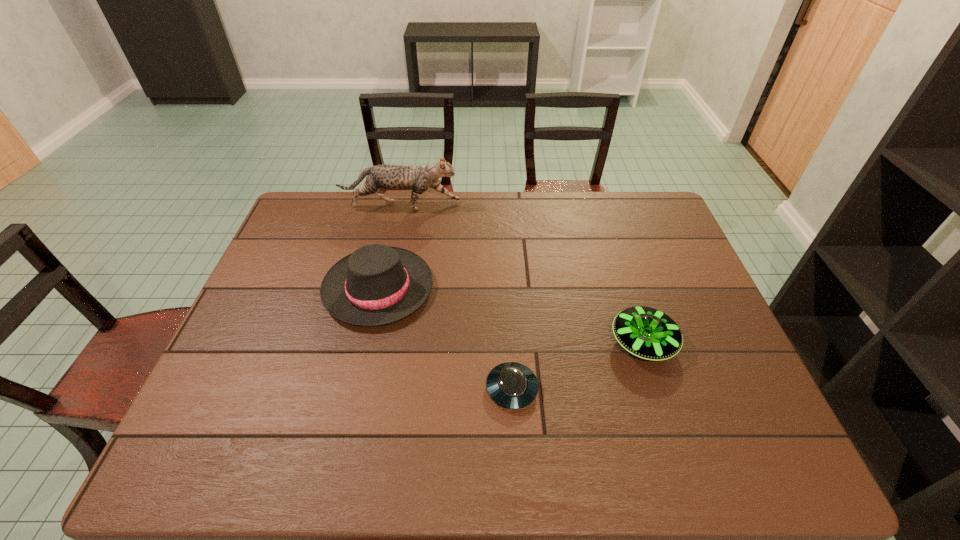
The height and width of the screenshot is (540, 960). I want to click on vacant space that satisfies the following two spatial constraints: 1. on the back side of the shortest object; 2. on the face of the tallest object, so click(x=501, y=206).

What are the coordinates of `vacant space that satisfies the following two spatial constraints: 1. on the face of the farthest object; 2. on the back side of the shortest object` in the screenshot? It's located at (361, 389).

Where is `vacant region that satisfies the following two spatial constraints: 1. on the face of the tallest object; 2. on the back side of the rightmost object`? The width and height of the screenshot is (960, 540). vacant region that satisfies the following two spatial constraints: 1. on the face of the tallest object; 2. on the back side of the rightmost object is located at coordinates click(x=372, y=342).

Where is `vacant point that satisfies the following two spatial constraints: 1. on the face of the right saucer; 2. on the left side of the cat`? vacant point that satisfies the following two spatial constraints: 1. on the face of the right saucer; 2. on the left side of the cat is located at coordinates [x=372, y=342].